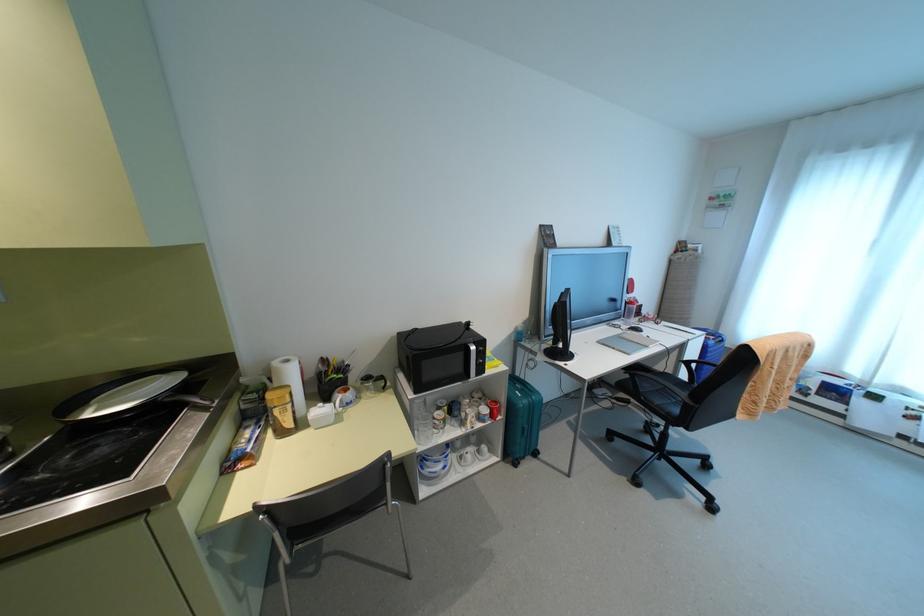
This screenshot has width=924, height=616. What do you see at coordinates (341, 402) in the screenshot?
I see `the mug handle with logo` at bounding box center [341, 402].